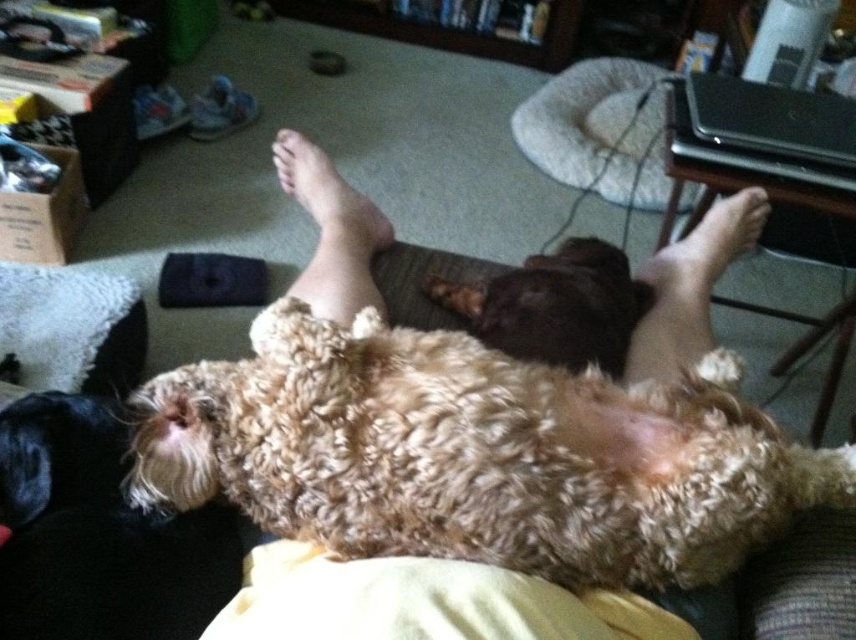
You are a guest entering the living room and see the brown curly fur dog at center and the brown furry foot at lower right. Which object is closer to you?

The brown curly fur dog at center is closer to you because the brown furry foot at lower right is behind it.